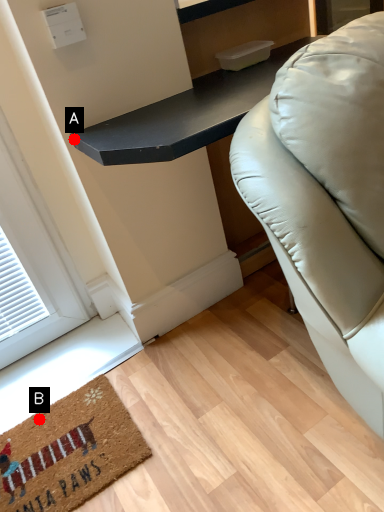
Question: Two points are circled on the image, labeled by A and B beside each circle. Which point is closer to the camera?

Choices:
 (A) A is closer
 (B) B is closer

Answer: (A)